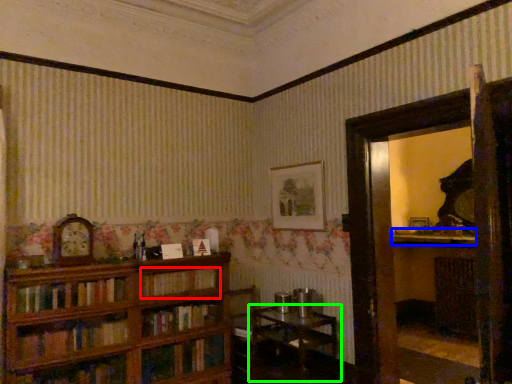
Question: Which object is the farthest from book (highlighted by a red box)? Choose among these: mantle (highlighted by a blue box) or table (highlighted by a green box).

Choices:
 (A) mantle
 (B) table

Answer: (A)